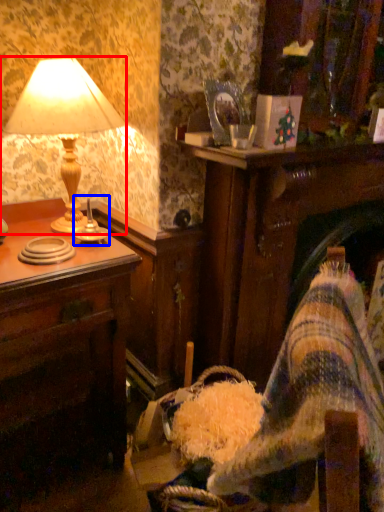
Question: Which of the following is the closest to the observer, lamp (highlighted by a red box) or candle holder (highlighted by a blue box)?

Choices:
 (A) lamp
 (B) candle holder

Answer: (A)